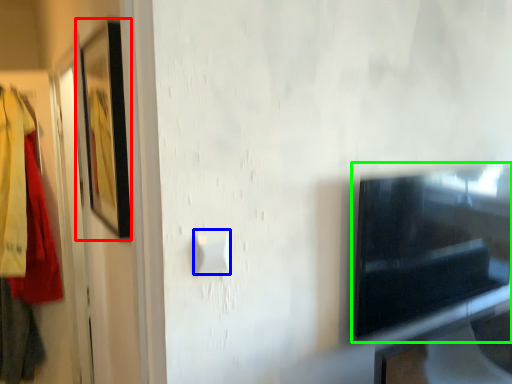
Question: Which object is the farthest from picture frame (highlighted by a red box)? Choose among these: light switch (highlighted by a blue box) or appliance (highlighted by a green box).

Choices:
 (A) light switch
 (B) appliance

Answer: (B)